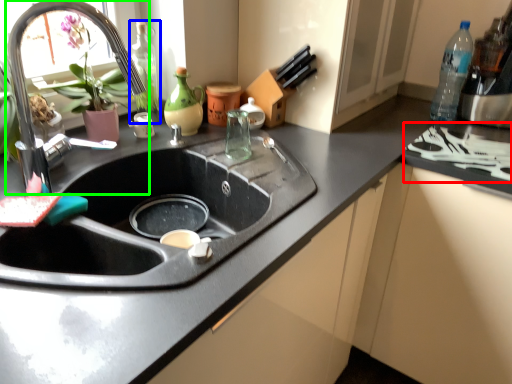
Question: Based on their relative distances, which object is farther from stove (highlighted by a red box)? Choose from bottle (highlighted by a blue box) and tap (highlighted by a green box).

Choices:
 (A) bottle
 (B) tap

Answer: (B)